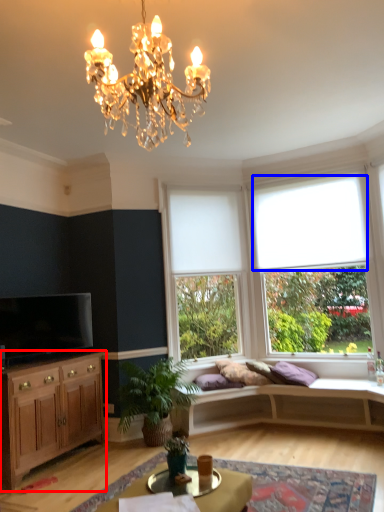
Question: Which point is further to the camera, cabinetry (highlighted by a red box) or curtain (highlighted by a blue box)?

Choices:
 (A) cabinetry
 (B) curtain

Answer: (B)